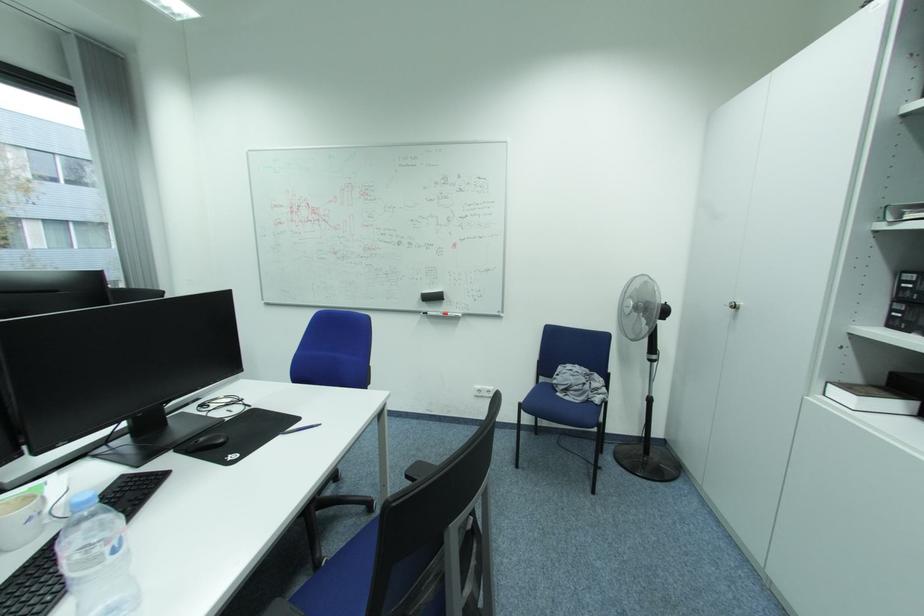
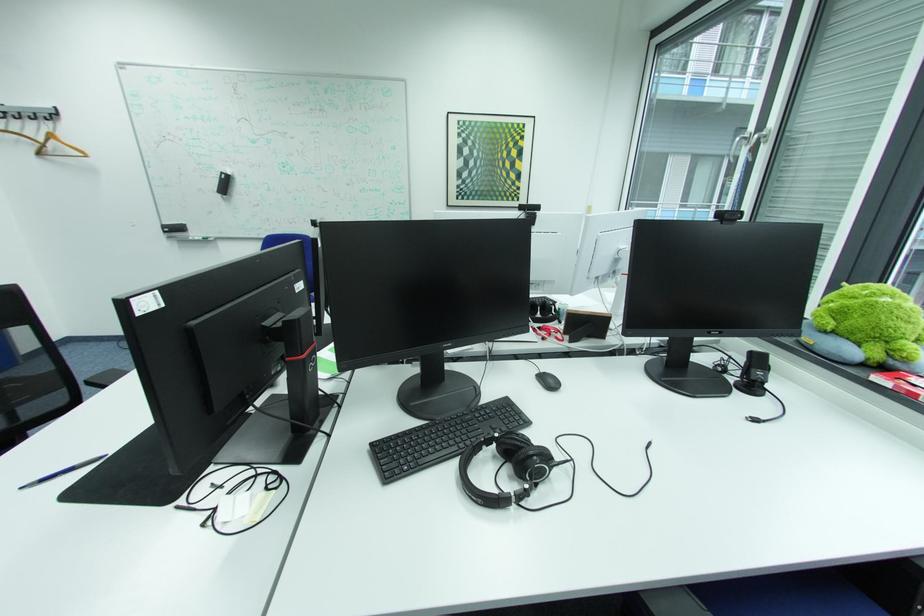
Locate, in the second image, the point that corresponds to point 259,407 in the first image.

(187, 508)